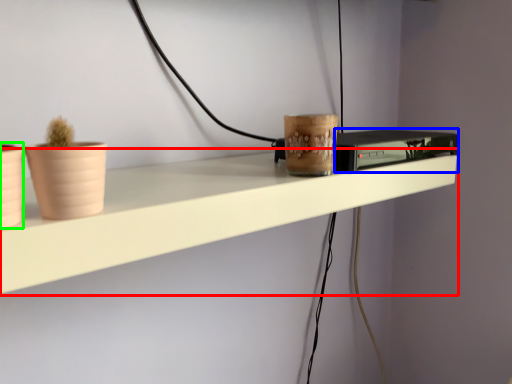
Question: Which object is the closest to the shelf (highlighted by a red box)? Choose among these: appliance (highlighted by a blue box) or flowerpot (highlighted by a green box).

Choices:
 (A) appliance
 (B) flowerpot

Answer: (A)